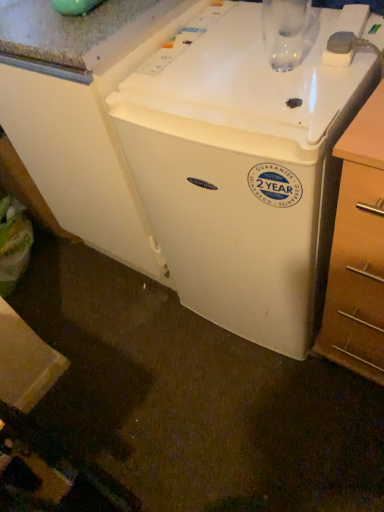
Question: Is point (354, 334) positioned closer to the camera than point (87, 131)?

Choices:
 (A) farther
 (B) closer

Answer: (A)

Question: From the image's perspective, is wooden at right positioned above or below white plastic refrigerator at center?

Choices:
 (A) above
 (B) below

Answer: (B)

Question: Would you say wooden at right is to the left or to the right of white plastic refrigerator at center in the picture?

Choices:
 (A) right
 (B) left

Answer: (A)

Question: Considering the positions of white plastic refrigerator at center and wooden at right in the image, is white plastic refrigerator at center taller or shorter than wooden at right?

Choices:
 (A) tall
 (B) short

Answer: (A)

Question: Considering the positions of point (231, 291) and point (324, 313), is point (231, 291) closer or farther from the camera than point (324, 313)?

Choices:
 (A) closer
 (B) farther

Answer: (B)

Question: From the image's perspective, is white plastic refrigerator at center above or below wooden at right?

Choices:
 (A) above
 (B) below

Answer: (A)

Question: Based on their sizes in the image, would you say white plastic refrigerator at center is bigger or smaller than wooden at right?

Choices:
 (A) big
 (B) small

Answer: (A)